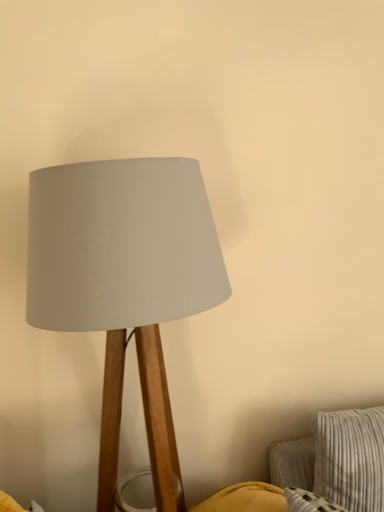
Image resolution: width=384 pixels, height=512 pixels. In order to click on matte wood lamp at center in this screenshot , I will do `click(125, 282)`.

What do you see at coordinates (125, 282) in the screenshot? I see `matte wood lamp at center` at bounding box center [125, 282].

Measure the distance between matte wood lamp at center and camera.

They are 29.33 inches apart.

Where is `striped fabric pillow at lower right`? The image size is (384, 512). striped fabric pillow at lower right is located at coordinates (350, 458).

Describe the element at coordinates (350, 458) in the screenshot. This screenshot has height=512, width=384. I see `striped fabric pillow at lower right` at that location.

Looking at this image, measure the distance between striped fabric pillow at lower right and camera.

3.87 feet.

What is the approximate width of striped fabric pillow at lower right?

It is 7.47 inches.

At what (x,y) coordinates should I click in order to perform the action: click on matte wood lamp at center. Please return your answer as a coordinate pair (x, y). This screenshot has width=384, height=512. Looking at the image, I should click on (125, 282).

Between striped fabric pillow at lower right and matte wood lamp at center, which one appears on the right side from the viewer's perspective?

striped fabric pillow at lower right.

Which is behind, striped fabric pillow at lower right or matte wood lamp at center?

striped fabric pillow at lower right is more distant.

Looking at this image, which is closer, (370, 439) or (68, 242)?

Positioned in front is point (68, 242).

Based on the photo, from the image's perspective, which object appears higher, striped fabric pillow at lower right or matte wood lamp at center?

From the image's view, matte wood lamp at center is above.

From a real-world perspective, is striped fabric pillow at lower right located higher than matte wood lamp at center?

No, from a real-world perspective, striped fabric pillow at lower right is not over matte wood lamp at center

Which of these two, striped fabric pillow at lower right or matte wood lamp at center, is wider?

matte wood lamp at center is wider.

Is striped fabric pillow at lower right shorter than matte wood lamp at center?

Correct, striped fabric pillow at lower right is not as tall as matte wood lamp at center.

Based on their sizes in the image, would you say striped fabric pillow at lower right is bigger or smaller than matte wood lamp at center?

Clearly, striped fabric pillow at lower right is smaller in size than matte wood lamp at center.

Is matte wood lamp at center surrounded by striped fabric pillow at lower right?

Definitely not — matte wood lamp at center is not inside striped fabric pillow at lower right.

Is striped fabric pillow at lower right touching matte wood lamp at center?

There is a gap between striped fabric pillow at lower right and matte wood lamp at center.

Is striped fabric pillow at lower right facing towards matte wood lamp at center?

No, striped fabric pillow at lower right does not turn towards matte wood lamp at center.

Locate an element on the screen. This screenshot has width=384, height=512. lamp located above the striped fabric pillow at lower right (from the image's perspective) is located at coordinates (125, 282).

Considering the relative positions of matte wood lamp at center and striped fabric pillow at lower right in the image provided, is matte wood lamp at center to the left of striped fabric pillow at lower right from the viewer's perspective?

Yes.

Between matte wood lamp at center and striped fabric pillow at lower right, which one is positioned in front?

matte wood lamp at center.

Does point (31, 264) appear closer or farther from the camera than point (323, 424)?

Point (31, 264) is positioned closer to the camera compared to point (323, 424).

From the image's perspective, which object appears higher, matte wood lamp at center or striped fabric pillow at lower right?

matte wood lamp at center.

From a real-world perspective, is matte wood lamp at center below striped fabric pillow at lower right?

No.

Looking at their sizes, would you say matte wood lamp at center is wider or thinner than striped fabric pillow at lower right?

Considering their sizes, matte wood lamp at center looks broader than striped fabric pillow at lower right.

Which of these two, matte wood lamp at center or striped fabric pillow at lower right, stands shorter?

striped fabric pillow at lower right is shorter.

Considering the sizes of matte wood lamp at center and striped fabric pillow at lower right in the image, is matte wood lamp at center bigger or smaller than striped fabric pillow at lower right?

In the image, matte wood lamp at center appears to be larger than striped fabric pillow at lower right.

Would you say striped fabric pillow at lower right is part of matte wood lamp at center's contents?

No, striped fabric pillow at lower right is not surrounded by matte wood lamp at center.

Is matte wood lamp at center far away from striped fabric pillow at lower right?

matte wood lamp at center is near striped fabric pillow at lower right, not far away.

Is matte wood lamp at center aimed at striped fabric pillow at lower right?

No, matte wood lamp at center is not aimed at striped fabric pillow at lower right.

How many degrees apart are the facing directions of matte wood lamp at center and striped fabric pillow at lower right?

They differ by 3.96 degrees in their facing directions.

Find the location of `pillow below the matte wood lamp at center (from a real-world perspective)`. pillow below the matte wood lamp at center (from a real-world perspective) is located at coordinates (350, 458).

The height and width of the screenshot is (512, 384). Find the location of `lamp in front of the striped fabric pillow at lower right`. lamp in front of the striped fabric pillow at lower right is located at coordinates (125, 282).

The height and width of the screenshot is (512, 384). What are the coordinates of `lamp lying above the striped fabric pillow at lower right (from the image's perspective)` in the screenshot? It's located at (125, 282).